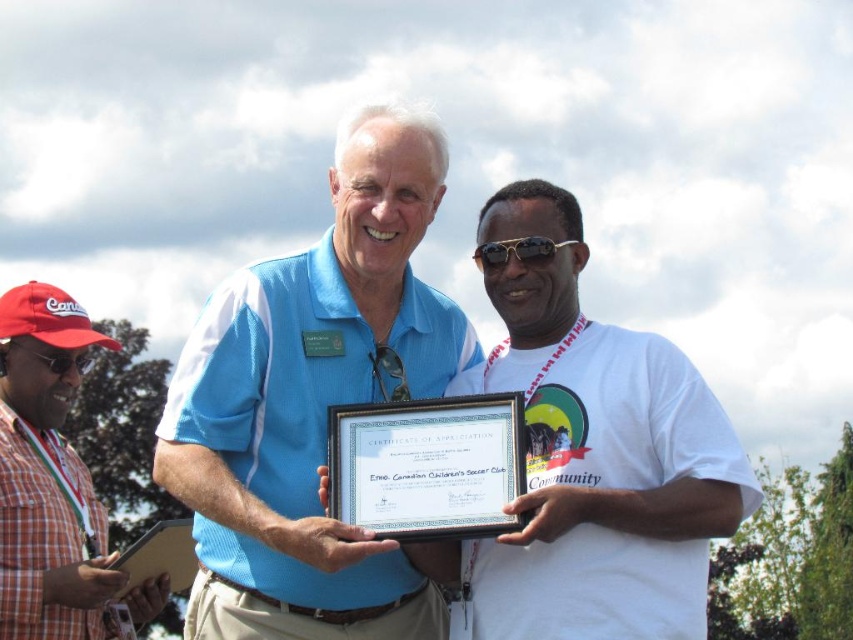
Question: Does white matte t-shirt at center have a lesser width compared to matte black goggles at left?

Choices:
 (A) yes
 (B) no

Answer: (A)

Question: Considering the real-world distances, which object is farthest from the matte black goggles at left?

Choices:
 (A) red plaid shirt at left
 (B) white paper certificate at center
 (C) gold metallic sunglasses at center

Answer: (C)

Question: Can you confirm if white matte t-shirt at center is positioned to the right of white paper certificate at center?

Choices:
 (A) yes
 (B) no

Answer: (A)

Question: Is gold metallic sunglasses at center further to camera compared to matte black goggles at left?

Choices:
 (A) yes
 (B) no

Answer: (B)

Question: Which object appears farthest from the camera in this image?

Choices:
 (A) gold metallic sunglasses at center
 (B) red plaid shirt at left

Answer: (B)

Question: Which point is closer to the camera taking this photo?

Choices:
 (A) (477, 525)
 (B) (78, 561)

Answer: (A)